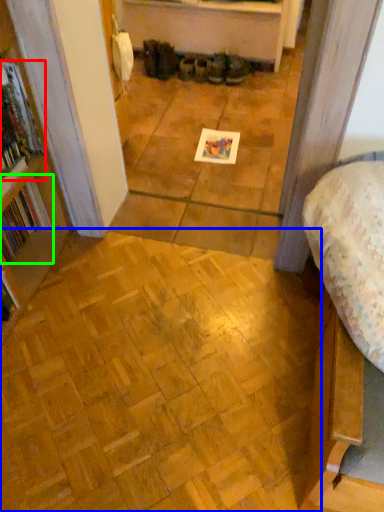
Question: Considering the real-world distances, which object is farthest from book (highlighted by a red box)? plywood (highlighted by a blue box) or book (highlighted by a green box)?

Choices:
 (A) plywood
 (B) book

Answer: (A)